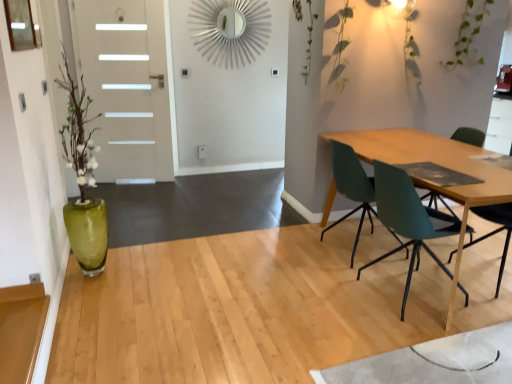
What do you see at coordinates (127, 86) in the screenshot? I see `white glossy door at left` at bounding box center [127, 86].

What do you see at coordinates (408, 218) in the screenshot? Image resolution: width=512 pixels, height=384 pixels. I see `teal plastic chair at right, which is the 1th chair in front-to-back order` at bounding box center [408, 218].

Identify the location of white glossy door at left. The width and height of the screenshot is (512, 384). (127, 86).

Is teal plastic chair at right, which is the 1th chair in front-to-back order, to the left or to the right of white glossy door at left in the image?

Clearly, teal plastic chair at right, which is the 1th chair in front-to-back order, is on the right of white glossy door at left in the image.

Would you say teal plastic chair at right, which is the 1th chair in front-to-back order, is inside or outside white glossy door at left?

teal plastic chair at right, which is the 1th chair in front-to-back order, is located beyond the bounds of white glossy door at left.

From a real-world perspective, which is physically above, teal plastic chair at right, which is the 1th chair in front-to-back order, or white glossy door at left?

white glossy door at left is physically above.

From the image's perspective, relative to teal matte chair at right, the second chair positioned from the front, is white glossy door at left above or below?

Based on their image positions, white glossy door at left is located above teal matte chair at right, the second chair positioned from the front.

Which of these two, white glossy door at left or teal matte chair at right, the second chair positioned from the front, is thinner?

white glossy door at left is thinner.

Considering the positions of objects white glossy door at left and teal matte chair at right, which is the first chair from back to front, in the image provided, who is behind, white glossy door at left or teal matte chair at right, which is the first chair from back to front,?

white glossy door at left is more distant.

Is teal matte chair at right, the second chair positioned from the front, aimed at teal plastic chair at right, the 2th chair in the back-to-front sequence?

No, teal matte chair at right, the second chair positioned from the front, does not turn towards teal plastic chair at right, the 2th chair in the back-to-front sequence.

Considering the relative positions of teal matte chair at right, the second chair positioned from the front, and teal plastic chair at right, which is the 1th chair in front-to-back order, in the image provided, is teal matte chair at right, the second chair positioned from the front, to the left or to the right of teal plastic chair at right, which is the 1th chair in front-to-back order,?

In the image, teal matte chair at right, the second chair positioned from the front, appears on the left side of teal plastic chair at right, which is the 1th chair in front-to-back order.

Consider the image. Who is more distant, teal matte chair at right, the second chair positioned from the front, or teal plastic chair at right, which is the 1th chair in front-to-back order?

teal matte chair at right, the second chair positioned from the front, is further from the camera.

How many degrees apart are the facing directions of teal matte chair at right, which is the first chair from back to front, and teal plastic chair at right, the 2th chair in the back-to-front sequence?

There is a 0.000322-degree angle between the facing directions of teal matte chair at right, which is the first chair from back to front, and teal plastic chair at right, the 2th chair in the back-to-front sequence.

Who is shorter, teal plastic chair at right, which is the 1th chair in front-to-back order, or teal matte chair at right, which is the first chair from back to front?

teal matte chair at right, which is the first chair from back to front, is shorter.

Between teal plastic chair at right, the 2th chair in the back-to-front sequence, and teal matte chair at right, which is the first chair from back to front, which one appears on the right side from the viewer's perspective?

From the viewer's perspective, teal plastic chair at right, the 2th chair in the back-to-front sequence, appears more on the right side.

Is teal plastic chair at right, the 2th chair in the back-to-front sequence, outside of teal matte chair at right, the second chair positioned from the front?

Yes, teal plastic chair at right, the 2th chair in the back-to-front sequence, is outside of teal matte chair at right, the second chair positioned from the front.

Is teal plastic chair at right, which is the 1th chair in front-to-back order, thinner than teal matte chair at right, the second chair positioned from the front?

No.

Can you tell me how much white glossy door at left and teal plastic chair at right, the 2th chair in the back-to-front sequence, differ in facing direction?

115 degrees separate the facing orientations of white glossy door at left and teal plastic chair at right, the 2th chair in the back-to-front sequence.

From the image's perspective, relative to teal plastic chair at right, the 2th chair in the back-to-front sequence, is white glossy door at left above or below?

white glossy door at left is above teal plastic chair at right, the 2th chair in the back-to-front sequence.

From the picture: Is white glossy door at left closer to camera compared to teal plastic chair at right, the 2th chair in the back-to-front sequence?

No, white glossy door at left is further to the viewer.

Does white glossy door at left have a lesser width compared to teal plastic chair at right, which is the 1th chair in front-to-back order?

Yes, white glossy door at left is thinner than teal plastic chair at right, which is the 1th chair in front-to-back order.

Consider the image. Do you think teal matte chair at right, the second chair positioned from the front, is within white glossy door at left, or outside of it?

teal matte chair at right, the second chair positioned from the front, is not inside white glossy door at left, it's outside.

Are teal matte chair at right, the second chair positioned from the front, and white glossy door at left located far from each other?

Absolutely, teal matte chair at right, the second chair positioned from the front, is distant from white glossy door at left.

Looking at the image, does teal matte chair at right, the second chair positioned from the front, seem bigger or smaller compared to white glossy door at left?

teal matte chair at right, the second chair positioned from the front, is smaller than white glossy door at left.

Which is closer to the camera, (356, 168) or (113, 62)?

The point (356, 168) is closer.

The width and height of the screenshot is (512, 384). Identify the location of door located on the left of teal plastic chair at right, which is the 1th chair in front-to-back order. pyautogui.click(x=127, y=86).

Where is `chair that is the 1st object located in front of the white glossy door at left`? This screenshot has width=512, height=384. chair that is the 1st object located in front of the white glossy door at left is located at coordinates (348, 182).

Consider the image. When comparing their distances from white glossy door at left, does teal plastic chair at right, which is the 1th chair in front-to-back order, or teal matte chair at right, which is the first chair from back to front, seem further?

teal plastic chair at right, which is the 1th chair in front-to-back order, is positioned further to the anchor white glossy door at left.

From the image, which object appears to be nearer to teal plastic chair at right, the 2th chair in the back-to-front sequence, white glossy door at left or teal matte chair at right, which is the first chair from back to front?

teal matte chair at right, which is the first chair from back to front.

Considering their positions, is white glossy door at left positioned closer to teal matte chair at right, which is the first chair from back to front, than teal plastic chair at right, the 2th chair in the back-to-front sequence?

teal plastic chair at right, the 2th chair in the back-to-front sequence, is positioned closer to the anchor teal matte chair at right, which is the first chair from back to front.

From the image, which object appears to be nearer to teal plastic chair at right, which is the 1th chair in front-to-back order, teal matte chair at right, the second chair positioned from the front, or white glossy door at left?

teal matte chair at right, the second chair positioned from the front, is positioned closer to the anchor teal plastic chair at right, which is the 1th chair in front-to-back order.

Estimate the real-world distances between objects in this image. Which object is closer to teal matte chair at right, the second chair positioned from the front, teal plastic chair at right, which is the 1th chair in front-to-back order, or white glossy door at left?

teal plastic chair at right, which is the 1th chair in front-to-back order, is positioned closer to the anchor teal matte chair at right, the second chair positioned from the front.

From the picture: When comparing their distances from white glossy door at left, does teal matte chair at right, the second chair positioned from the front, or teal plastic chair at right, which is the 1th chair in front-to-back order, seem further?

Among the two, teal plastic chair at right, which is the 1th chair in front-to-back order, is located further to white glossy door at left.

The image size is (512, 384). I want to click on chair located between white glossy door at left and teal plastic chair at right, the 2th chair in the back-to-front sequence, in the left-right direction, so click(x=348, y=182).